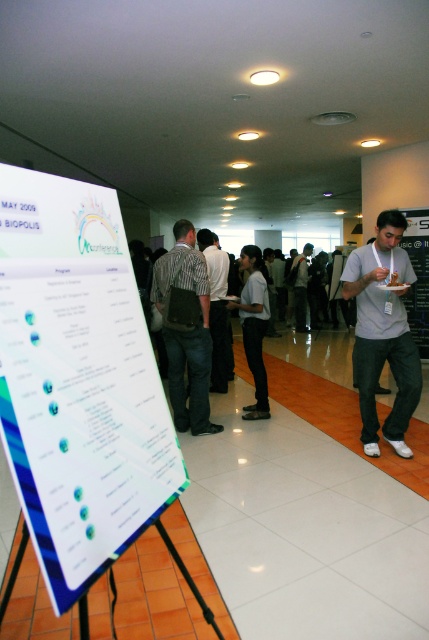
Question: Which of these objects is positioned farthest from the dark gray shirt at center?

Choices:
 (A) gray matte t-shirt at right
 (B) matte white poster at center

Answer: (A)

Question: Observing the image, what is the correct spatial positioning of white glossy poster at left in reference to striped fabric shirt at center?

Choices:
 (A) left
 (B) right

Answer: (B)

Question: Is striped fabric shirt at center below dark gray shirt at center?

Choices:
 (A) no
 (B) yes

Answer: (B)

Question: Among these objects, which one is nearest to the camera?

Choices:
 (A) white shirt at center
 (B) striped fabric shirt at center
 (C) matte white poster at center

Answer: (B)

Question: Is white shirt at center above matte white poster at center?

Choices:
 (A) no
 (B) yes

Answer: (A)

Question: Which of the following is the farthest from the observer?

Choices:
 (A) white glossy poster at left
 (B) white shirt at center

Answer: (B)